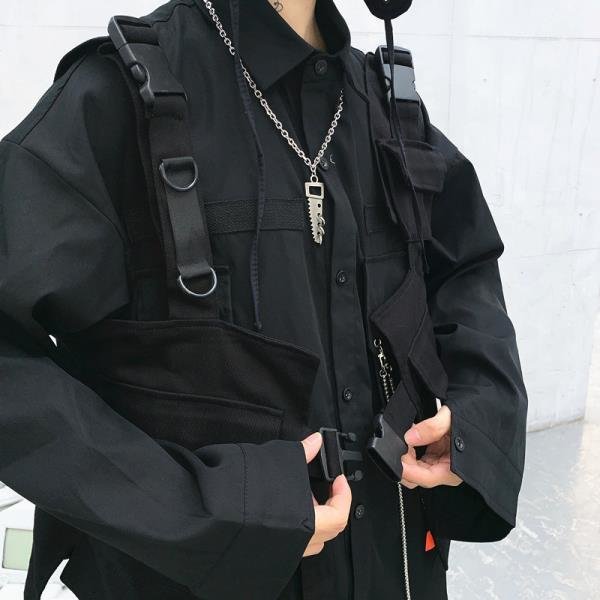
Where is `cement wall`? Image resolution: width=600 pixels, height=600 pixels. cement wall is located at coordinates (535, 163).